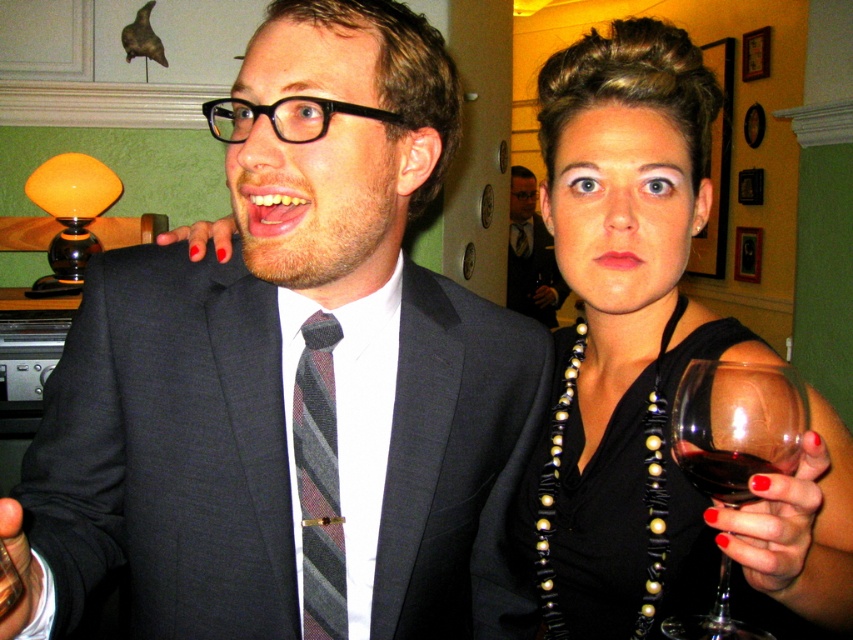
You are a photographer at a party and want to capture a closeup of the dark red liquid at right without the black satin dress at center overlapping it. Is this possible given their sizes?

The black satin dress at center is wider than the dark red liquid at right, so it might block the view. To avoid overlap, move the camera angle or reposition the subjects so the dress isn